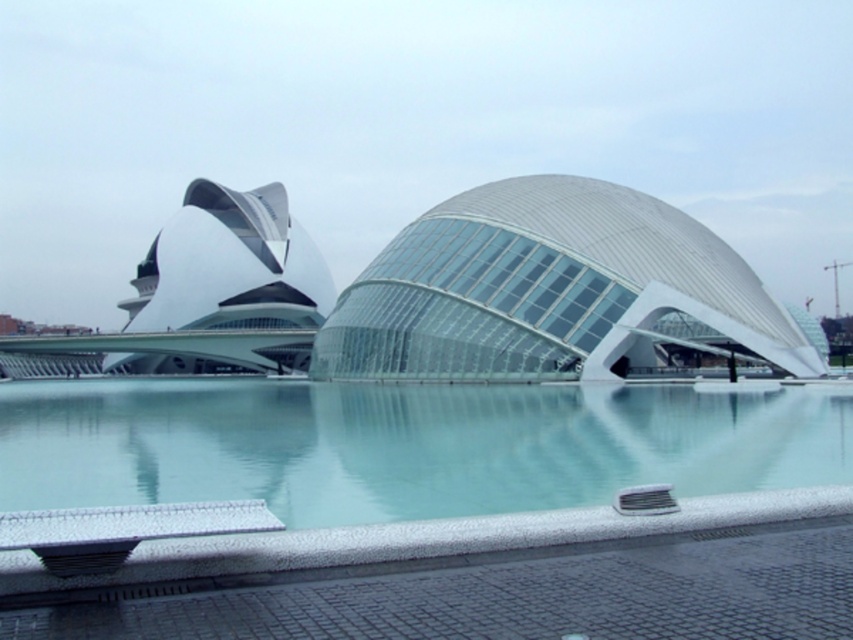
Question: Can you confirm if transparent glass dome at center is bigger than white speckled tile swimming pool at lower center?

Choices:
 (A) yes
 (B) no

Answer: (A)

Question: Which point is closer to the camera?

Choices:
 (A) transparent glass dome at center
 (B) white speckled tile swimming pool at lower center

Answer: (B)

Question: Is transparent glass dome at center closer to camera compared to white speckled tile swimming pool at lower center?

Choices:
 (A) no
 (B) yes

Answer: (A)

Question: From the image, what is the correct spatial relationship of transparent glass dome at center in relation to white speckled tile swimming pool at lower center?

Choices:
 (A) left
 (B) right

Answer: (A)